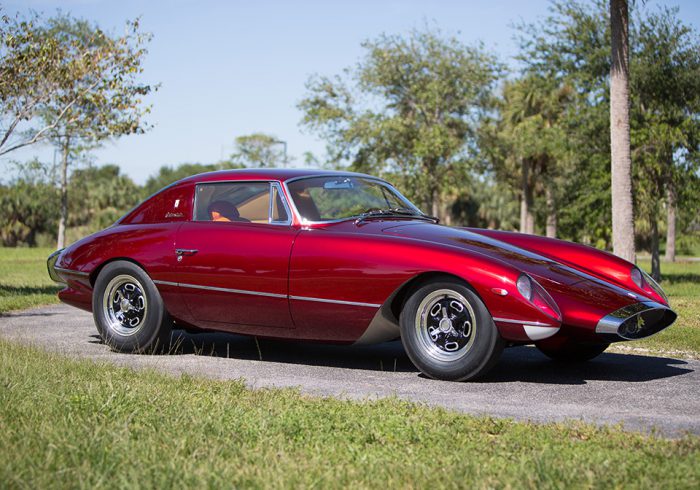
Where is `door handle`? door handle is located at coordinates (190, 252).